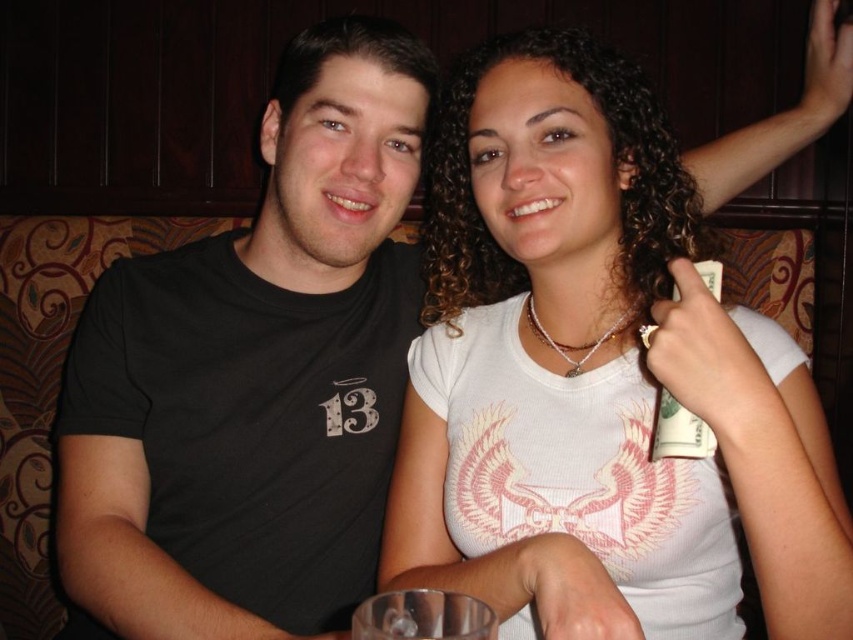
Question: Which of the following is the closest to the observer?

Choices:
 (A) (302, 225)
 (B) (662, 444)
 (C) (579, 593)

Answer: (C)

Question: Does white matte shirt at upper right have a lesser width compared to white paper money at upper right?

Choices:
 (A) yes
 (B) no

Answer: (B)

Question: Among these points, which one is farthest from the camera?

Choices:
 (A) (680, 406)
 (B) (91, 573)
 (C) (529, 132)

Answer: (B)

Question: Which point is closer to the camera?

Choices:
 (A) white paper money at upper right
 (B) white matte shirt at upper right

Answer: (B)

Question: Is white matte shirt at upper right to the left of black matte t-shirt at left from the viewer's perspective?

Choices:
 (A) no
 (B) yes

Answer: (A)

Question: Can you confirm if white matte shirt at upper right is smaller than black matte t-shirt at left?

Choices:
 (A) no
 (B) yes

Answer: (B)